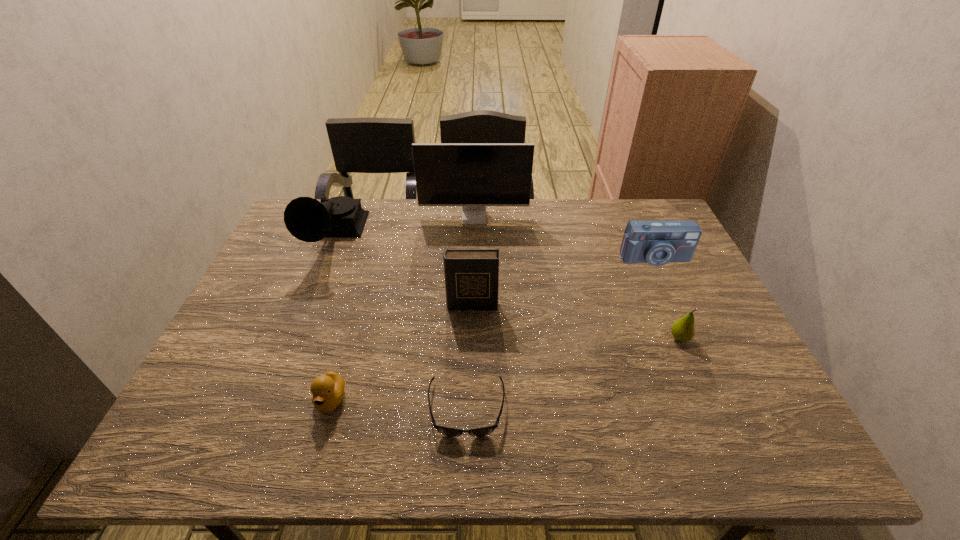
Find the location of `monitor`. monitor is located at coordinates (473, 175).

The width and height of the screenshot is (960, 540). I want to click on phonograph_record, so click(x=307, y=219).

At what (x,y) coordinates should I click in order to perform the action: click on the sixth shortest object. Please return your answer as a coordinate pair (x, y). This screenshot has width=960, height=540. Looking at the image, I should click on (307, 219).

The width and height of the screenshot is (960, 540). Find the location of `the fifth shortest object`. the fifth shortest object is located at coordinates (471, 275).

You are a GUI agent. You are given a task and a screenshot of the screen. Output one action in this format:
    pyautogui.click(x=<x>, y=<y>)
    Task: Click on the fourth nearest object
    This screenshot has width=960, height=540.
    Given the screenshot: What is the action you would take?
    pyautogui.click(x=471, y=275)

Locate an element on the screen. This screenshot has height=540, width=960. camera is located at coordinates (657, 243).

The width and height of the screenshot is (960, 540). I want to click on pear, so click(x=682, y=330).

What are the coordinates of `the third nearest object` in the screenshot? It's located at (682, 330).

Identify the location of the second shortest object. This screenshot has height=540, width=960. (327, 390).

Find the location of a particular element. the second object from left to right is located at coordinates (327, 390).